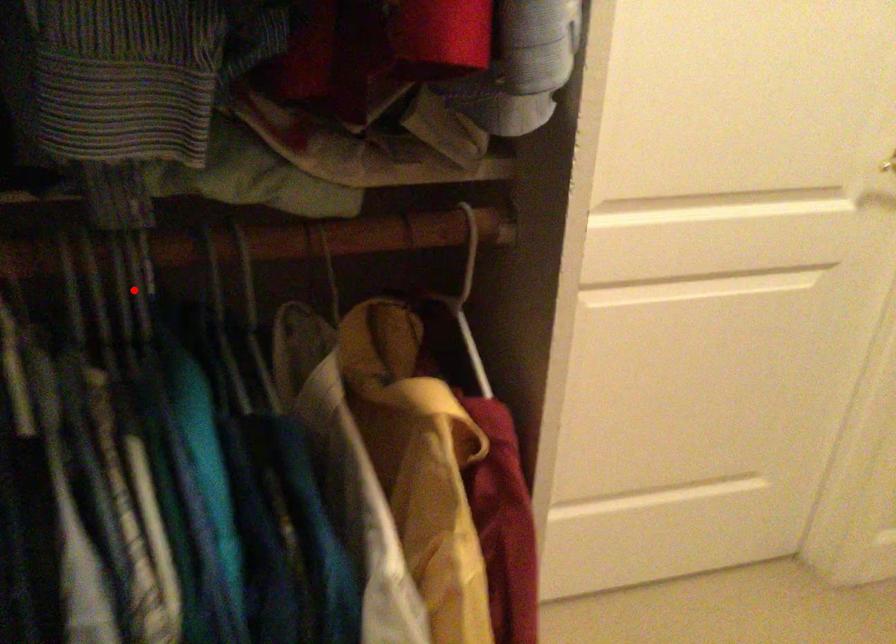
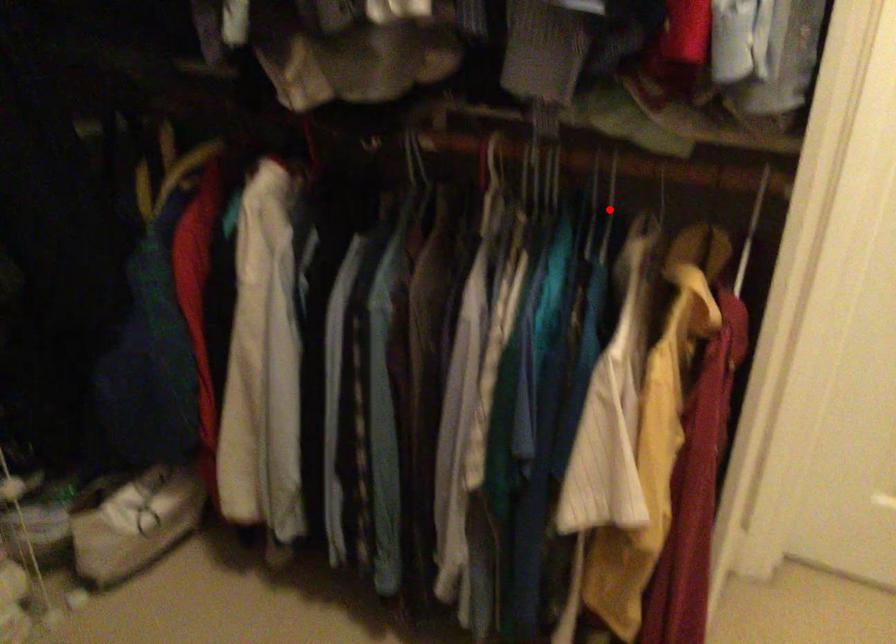
I am providing you with two images of the same scene from different viewpoints. A red point is marked on the first image and another point is marked on the second image. Do the highlighted points in image1 and image2 indicate the same real-world spot?

No